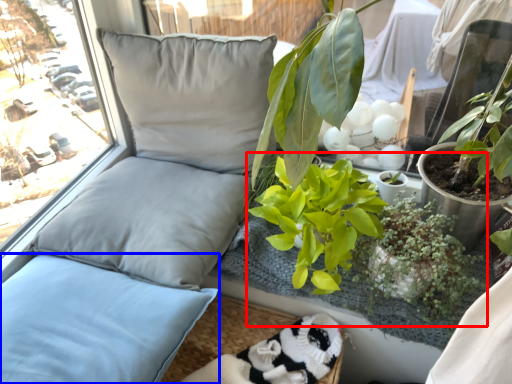
Question: Which object is closer to the camera taking this photo, floral arrangement (highlighted by a red box) or pillow (highlighted by a blue box)?

Choices:
 (A) floral arrangement
 (B) pillow

Answer: (B)